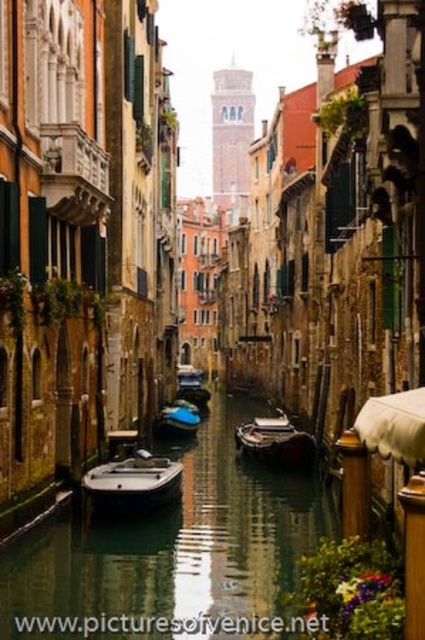
You are a tour guide explaining the canal boats to visitors. You mention both the white matte boat at center and the blue glossy boat at center. Which boat do you think is wider?

The white matte boat at center is wider than the blue glossy boat at center.

You are a tour guide leading a group along the canal in Venice. You want to ensure that a new boat, which is 100 feet long, can safely navigate between the green glossy waterway at center and the blue glossy boat at center without touching either. Based on the scene, is there enough space for the boat to pass through?

The green glossy waterway at center and blue glossy boat at center are 104.27 feet apart from each other. Since the new boat is 100 feet long, there is sufficient space for it to pass through without touching either object, as the distance between them exceeds the boat length by approximately 4.27 feet.

You are standing at the point with coordinates point [99,496] and want to see the point with coordinates point [249,452]. Can you see it without any obstructions?

Point [99,496] is in front of point [249,452], so you cannot see point [249,452] from point [99,496] because it is obstructed by the building in between.